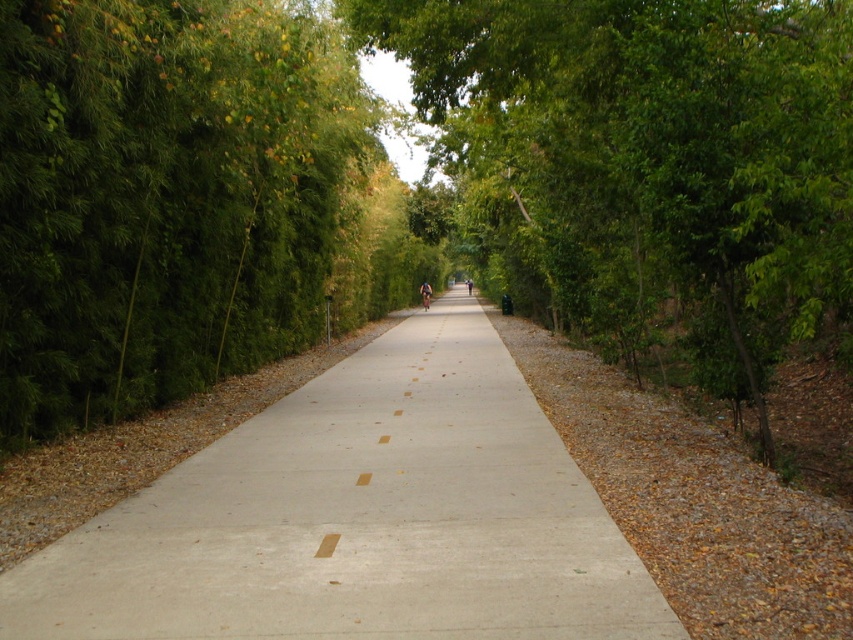
Question: Can you confirm if green leafy tree at center is positioned below dark blue shirt at center?

Choices:
 (A) yes
 (B) no

Answer: (A)

Question: Which object is closer to the camera taking this photo?

Choices:
 (A) concrete at center
 (B) green leafy tree at center
 (C) dark blue shirt at center
 (D) blue fabric cyclist at center

Answer: (A)

Question: Which of the following is the farthest from the observer?

Choices:
 (A) dark blue shirt at center
 (B) blue fabric cyclist at center
 (C) concrete at center
 (D) green leafy tree at center

Answer: (A)

Question: Is green leafy tree at center bigger than blue fabric cyclist at center?

Choices:
 (A) yes
 (B) no

Answer: (A)

Question: Can you confirm if blue fabric cyclist at center is positioned below dark blue shirt at center?

Choices:
 (A) yes
 (B) no

Answer: (A)

Question: Which point appears closest to the camera in this image?

Choices:
 (A) (395, 614)
 (B) (680, 156)
 (C) (422, 308)
 (D) (463, 282)

Answer: (A)